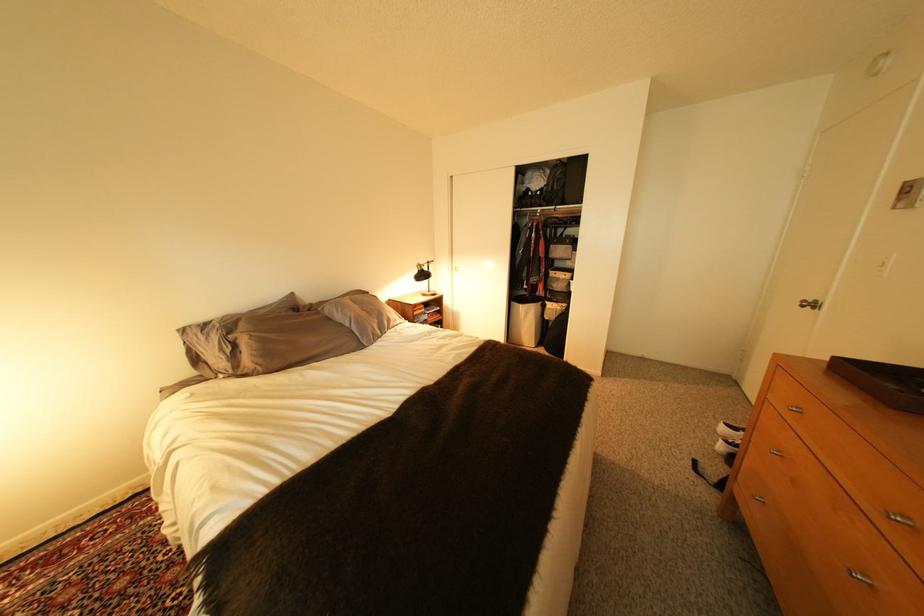
This screenshot has height=616, width=924. Find the location of `silver drawer handle`. silver drawer handle is located at coordinates (795, 411).